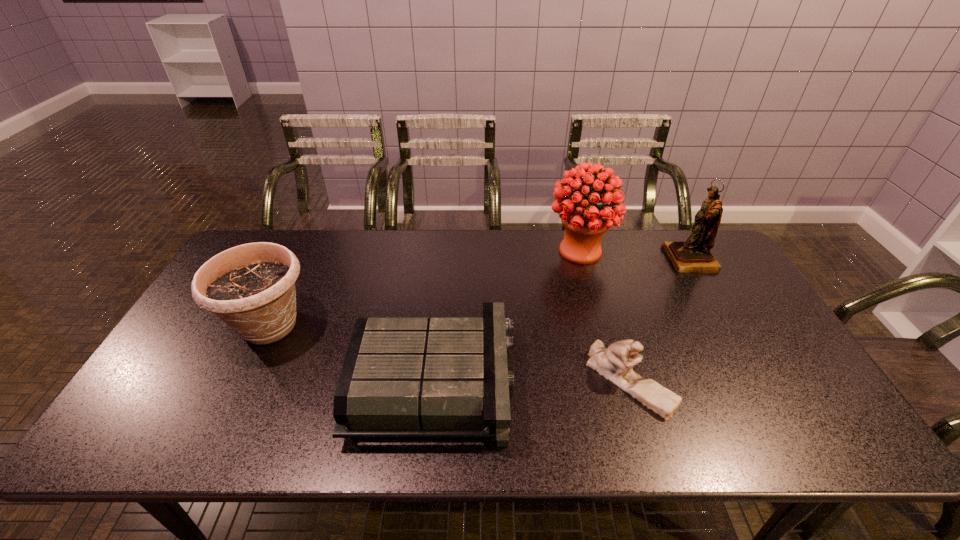
Image resolution: width=960 pixels, height=540 pixels. I want to click on bouquet, so click(x=585, y=222).

Identify the location of the taller figurine. click(693, 255).

Image resolution: width=960 pixels, height=540 pixels. I want to click on the rightmost object, so click(x=693, y=255).

You are a GUI agent. You are given a task and a screenshot of the screen. Output one action in this format:
    pyautogui.click(x=<x>, y=<y>)
    Task: Click on the leftmost object
    
    Given the screenshot: What is the action you would take?
    pyautogui.click(x=251, y=287)

Identify the location of the third shortest object. The width and height of the screenshot is (960, 540). (251, 287).

Where is `the nearer figurine`? This screenshot has height=540, width=960. the nearer figurine is located at coordinates (614, 363).

Locate an element on the screen. The height and width of the screenshot is (540, 960). the fourth tallest object is located at coordinates (614, 363).

Locate an element on the screen. This screenshot has width=960, height=540. the second object from left to right is located at coordinates (403, 376).

What are the coordinates of `radio receiver` in the screenshot? It's located at (403, 376).

Locate an element on the screen. free space located on the front of the bouquet is located at coordinates (612, 363).